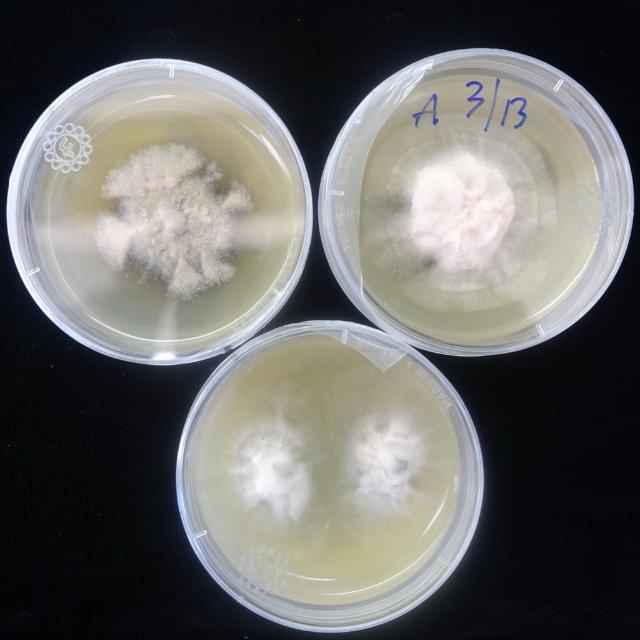
Does white fluffy substance at center have a larger size compared to white fluffy mold at center?

Yes.

Is point (401, 573) behind point (125, 248)?

Yes, it is behind point (125, 248).

Is point (420, 556) positioned after point (157, 225)?

That is True.

The width and height of the screenshot is (640, 640). I want to click on white fluffy substance at center, so click(x=324, y=468).